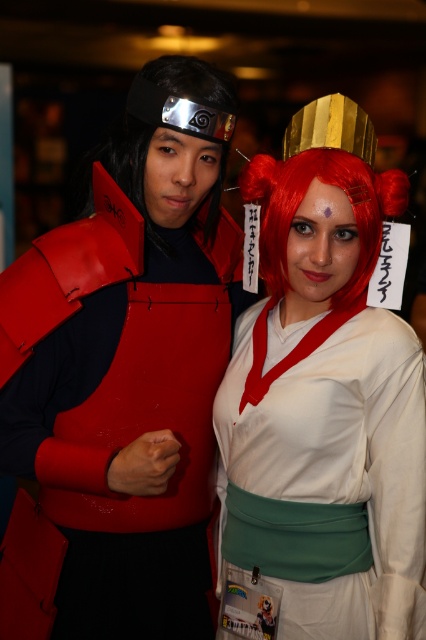
Question: Which object is positioned farthest from the yellow paper comic book at lower center?

Choices:
 (A) white matte kimono at center
 (B) rubberized red vest at left

Answer: (B)

Question: Among these objects, which one is nearest to the camera?

Choices:
 (A) shiny red wig at center
 (B) yellow paper comic book at lower center
 (C) white matte kimono at center
 (D) rubberized red vest at left

Answer: (C)

Question: Among these objects, which one is farthest from the camera?

Choices:
 (A) white matte kimono at center
 (B) yellow paper comic book at lower center
 (C) shiny red wig at center
 (D) rubberized red vest at left

Answer: (D)

Question: Is rubberized red vest at left to the right of shiny red wig at center from the viewer's perspective?

Choices:
 (A) no
 (B) yes

Answer: (A)

Question: Is white matte kimono at center thinner than rubberized red vest at left?

Choices:
 (A) yes
 (B) no

Answer: (A)

Question: Does white matte kimono at center have a smaller size compared to rubberized red vest at left?

Choices:
 (A) no
 (B) yes

Answer: (B)